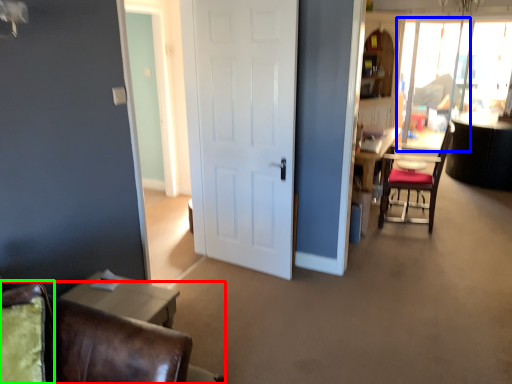
Question: Estimate the real-world distances between objects in this image. Which object is farther from chair (highlighted by a red box), window screen (highlighted by a blue box) or swivel chair (highlighted by a green box)?

Choices:
 (A) window screen
 (B) swivel chair

Answer: (A)